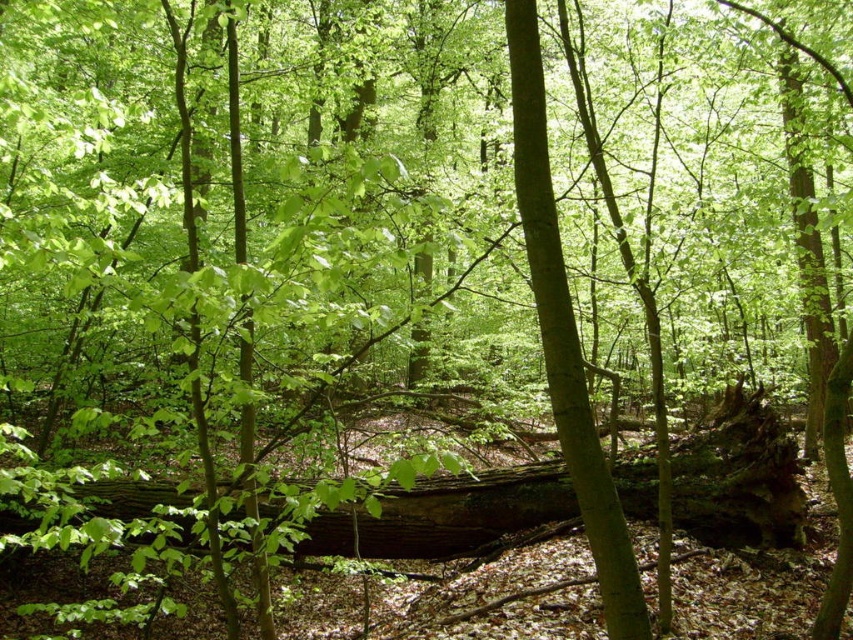
You are a hiker carrying a backpack and need to cross the path blocked by the rough bark log at center and the green matte tree trunk at center. Which object should you step over first based on their sizes?

The rough bark log at center is bigger than the green matte tree trunk at center, so you should step over the rough bark log at center first as it is larger and likely easier to navigate over.

You are a hiker who wants to take a photo of the green matte tree trunk at center without the rough bark log at center blocking it. How should you adjust your position?

The green matte tree trunk at center is behind the rough bark log at center, so you should move to a position where you can see behind the rough bark log at center to capture the green matte tree trunk at center unobstructed.